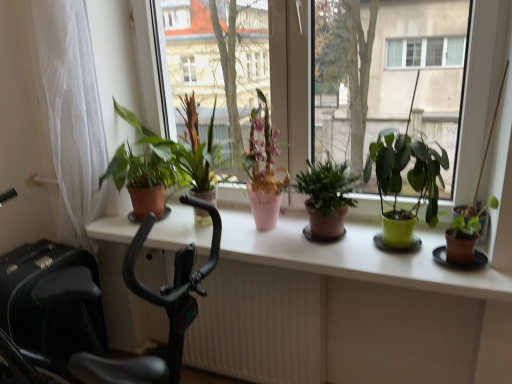
Where is `vacant area that lies between green matte plant at center, the 3th houseplant viewed from the left, and green matte plant at center, which is the 4th houseplant in left-to-right order`? The image size is (512, 384). vacant area that lies between green matte plant at center, the 3th houseplant viewed from the left, and green matte plant at center, which is the 4th houseplant in left-to-right order is located at coordinates (384, 257).